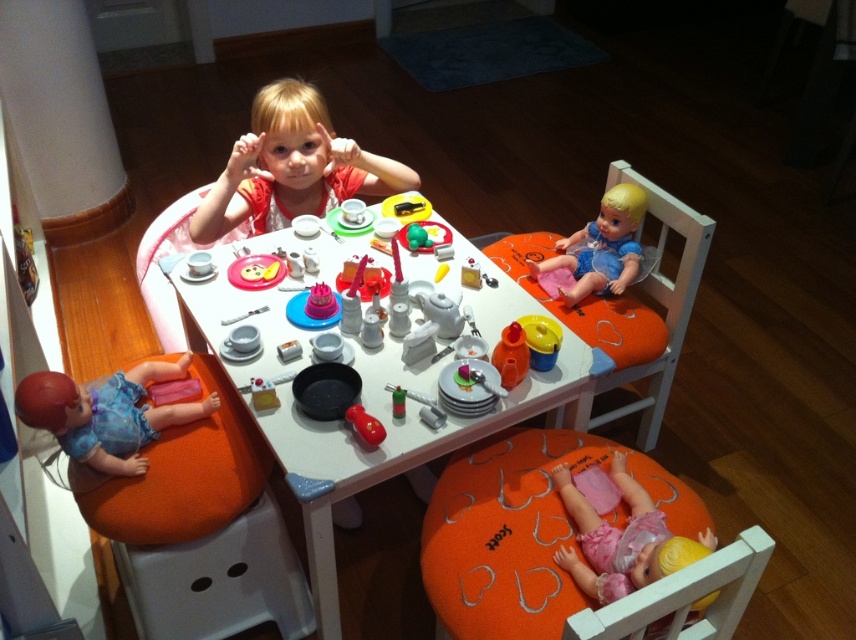
You are a child trying to decide whether the smooth plastic doll at upper right can be placed on top of the metallic silver fork at upper center without falling over. Based on their sizes, is this possible?

The smooth plastic doll at upper right is taller than the metallic silver fork at upper center. Since the doll is taller, placing it on top might cause instability and could result in it falling over.

You are a parent setting up a tea party for your child. You have two dolls, the pink fabric doll at lower right and the smooth plastic doll at upper right. Which doll is shorter?

The pink fabric doll at lower right is shorter than the smooth plastic doll at upper right.